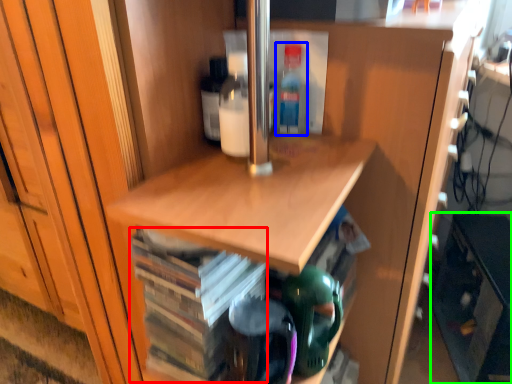
Question: Which is nearer to the book (highlighted by a red box)? bottle (highlighted by a blue box) or cabinetry (highlighted by a green box).

Choices:
 (A) bottle
 (B) cabinetry

Answer: (A)